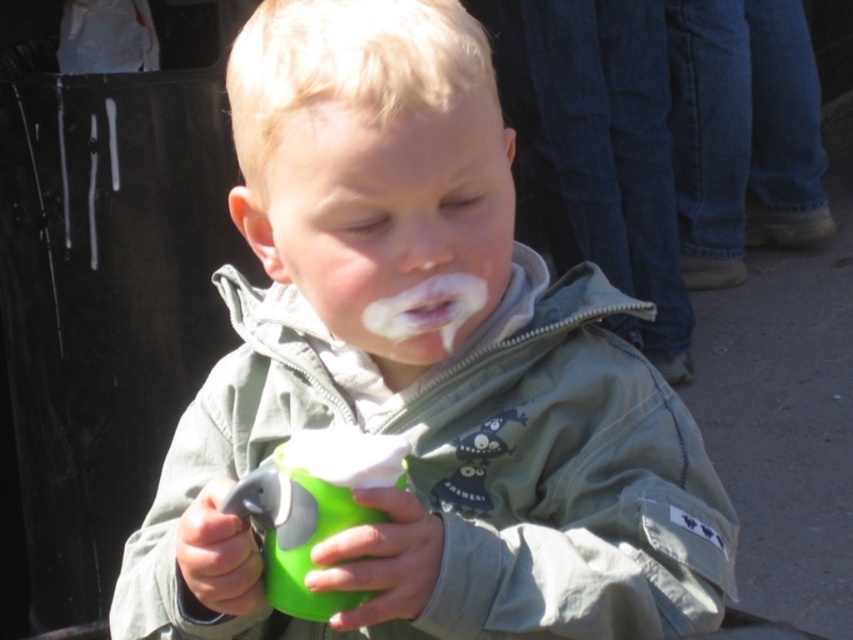
Question: Which is farther from the green matte cup at center?

Choices:
 (A) green rubber cup at center
 (B) white matte mouth at center
 (C) smooth flesh nose at center
 (D) white matte frosting at mouth center

Answer: (C)

Question: Can you confirm if green rubber cup at center is bigger than white matte frosting at mouth center?

Choices:
 (A) yes
 (B) no

Answer: (A)

Question: Does smooth flesh nose at center appear over white matte mouth at center?

Choices:
 (A) yes
 (B) no

Answer: (A)

Question: Which of the following is the closest to the observer?

Choices:
 (A) white matte frosting at mouth center
 (B) green matte cup at center

Answer: (B)

Question: Estimate the real-world distances between objects in this image. Which object is closer to the white matte mouth at center?

Choices:
 (A) green matte cup at center
 (B) green rubber cup at center
 (C) smooth flesh nose at center
 (D) white matte frosting at mouth center

Answer: (D)

Question: Does green matte cup at center appear on the left side of white matte frosting at mouth center?

Choices:
 (A) no
 (B) yes

Answer: (B)